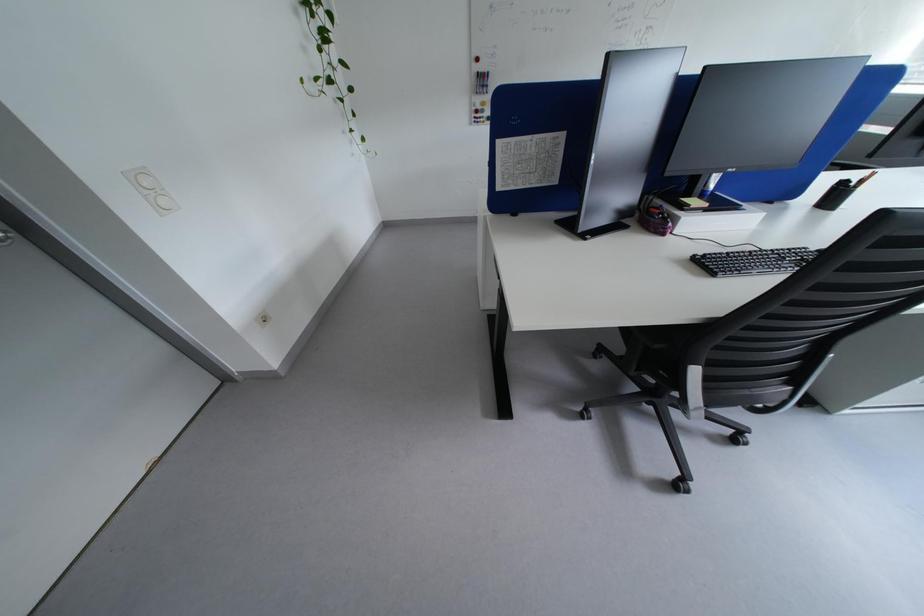
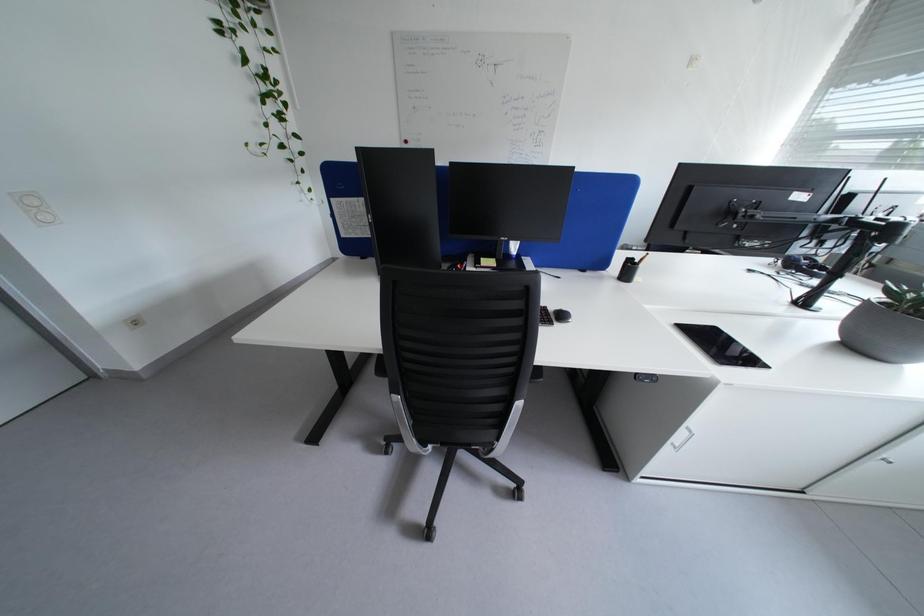
Question: Based on the continuous images, in which direction is the camera rotating? Reply with the corresponding letter.

Choices:
 (A) Left
 (B) Right
 (C) Up
 (D) Down

Answer: (C)